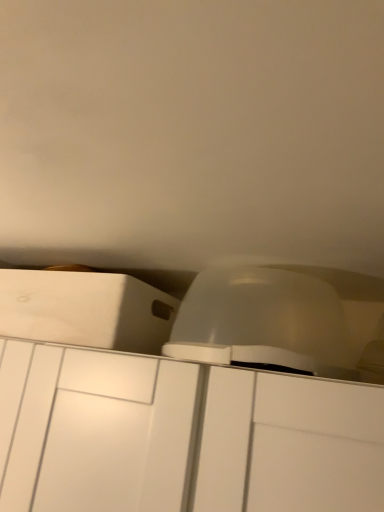
Question: From a real-world perspective, is white matte cabinet at center, the second cabinetry when ordered from top to bottom, located beneath transparent plastic dome at center?

Choices:
 (A) yes
 (B) no

Answer: (A)

Question: From a real-world perspective, is white matte cabinet at center, the second cabinetry when ordered from top to bottom, physically above transparent plastic dome at center?

Choices:
 (A) no
 (B) yes

Answer: (A)

Question: Is white matte cabinet at center, which appears as the 1th cabinetry when ordered from the bottom, positioned with its back to transparent plastic dome at center?

Choices:
 (A) no
 (B) yes

Answer: (A)

Question: Is white matte cabinet at center, which appears as the 1th cabinetry when ordered from the bottom, not near transparent plastic dome at center?

Choices:
 (A) no
 (B) yes

Answer: (A)

Question: Would you say transparent plastic dome at center is part of white matte cabinet at center, the second cabinetry when ordered from top to bottom,'s contents?

Choices:
 (A) yes
 (B) no

Answer: (B)

Question: From a real-world perspective, is transparent plastic dome at center positioned above or below white matte cabinet at center, the second cabinetry when ordered from top to bottom?

Choices:
 (A) below
 (B) above

Answer: (B)

Question: In the image, is transparent plastic dome at center on the left side or the right side of white matte cabinet at center, which appears as the 1th cabinetry when ordered from the bottom?

Choices:
 (A) left
 (B) right

Answer: (B)

Question: Is point pyautogui.click(x=198, y=330) positioned closer to the camera than point pyautogui.click(x=8, y=418)?

Choices:
 (A) farther
 (B) closer

Answer: (A)

Question: Considering the positions of transparent plastic dome at center and white matte cabinet at center, which appears as the 1th cabinetry when ordered from the bottom, in the image, is transparent plastic dome at center taller or shorter than white matte cabinet at center, which appears as the 1th cabinetry when ordered from the bottom,?

Choices:
 (A) tall
 (B) short

Answer: (B)

Question: Considering the positions of white matte cabinet at upper left, acting as the 2th cabinetry starting from the bottom, and white matte cabinet at center, the second cabinetry when ordered from top to bottom, in the image, is white matte cabinet at upper left, acting as the 2th cabinetry starting from the bottom, taller or shorter than white matte cabinet at center, the second cabinetry when ordered from top to bottom,?

Choices:
 (A) short
 (B) tall

Answer: (A)

Question: Is point (155, 330) positioned closer to the camera than point (140, 397)?

Choices:
 (A) closer
 (B) farther

Answer: (B)

Question: From a real-world perspective, is white matte cabinet at upper left, acting as the 2th cabinetry starting from the bottom, physically located above or below white matte cabinet at center, which appears as the 1th cabinetry when ordered from the bottom?

Choices:
 (A) below
 (B) above

Answer: (B)

Question: Choose the correct answer: Is white matte cabinet at upper left, acting as the 2th cabinetry starting from the bottom, inside white matte cabinet at center, the second cabinetry when ordered from top to bottom, or outside it?

Choices:
 (A) inside
 (B) outside

Answer: (B)

Question: From the image's perspective, is white matte cabinet at upper left, acting as the 2th cabinetry starting from the bottom, positioned above or below transparent plastic dome at center?

Choices:
 (A) below
 (B) above

Answer: (A)

Question: Visually, is white matte cabinet at upper left, the 1th cabinetry when ordered from top to bottom, positioned to the left or to the right of transparent plastic dome at center?

Choices:
 (A) left
 (B) right

Answer: (A)